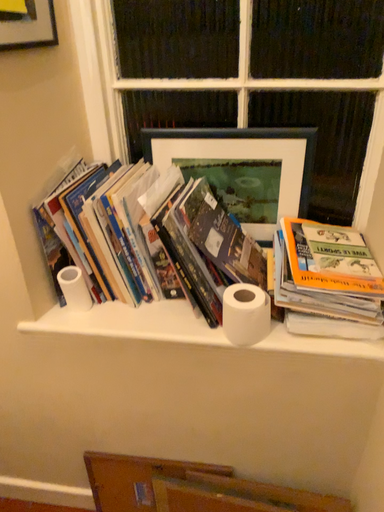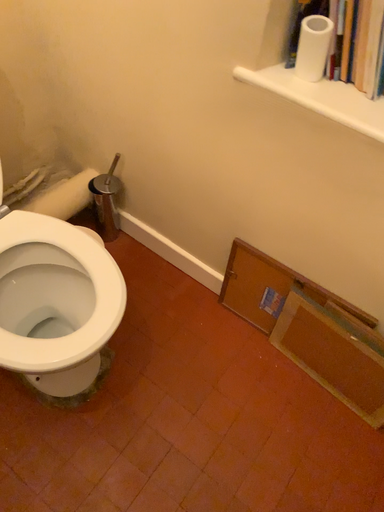
Question: How did the camera likely rotate when shooting the video?

Choices:
 (A) rotated upward
 (B) rotated downward

Answer: (B)